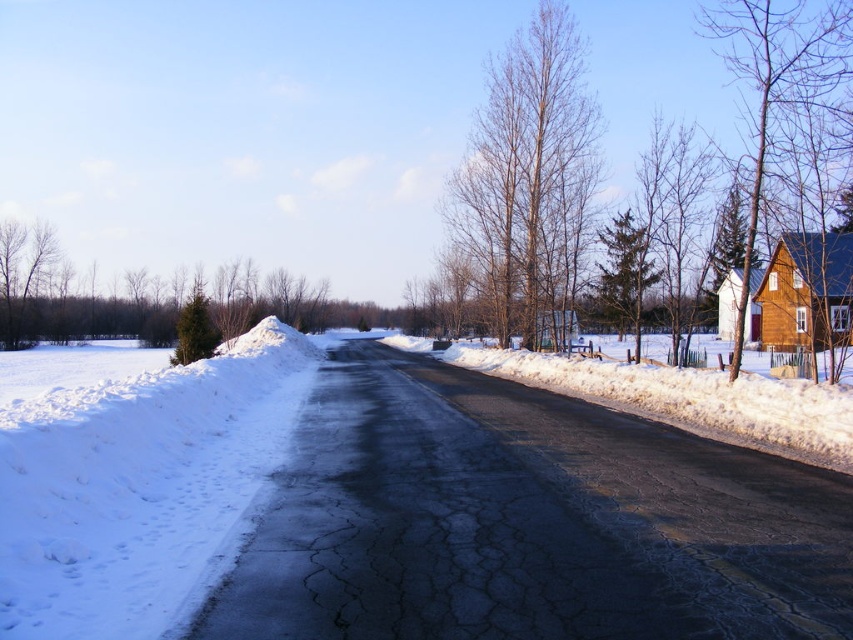
Question: Estimate the real-world distances between objects in this image. Which object is farther from the green textured pine at left?

Choices:
 (A) white fluffy snow at left
 (B) green textured evergreen tree at center-right
 (C) brown wooden tree at upper right

Answer: (A)

Question: Which point is farther from the camera taking this photo?

Choices:
 (A) (193, 285)
 (B) (80, 444)

Answer: (A)

Question: Is brown wooden tree at upper right wider than bare branches at upper center?

Choices:
 (A) no
 (B) yes

Answer: (B)

Question: Is green textured pine at left in front of green matte evergreen tree at left?

Choices:
 (A) no
 (B) yes

Answer: (A)

Question: Which of the following is the farthest from the observer?

Choices:
 (A) (590, 145)
 (B) (646, 243)
 (C) (694, 250)

Answer: (A)

Question: Does white powdery snow at center have a lesser width compared to bare wood tree at right?

Choices:
 (A) yes
 (B) no

Answer: (A)